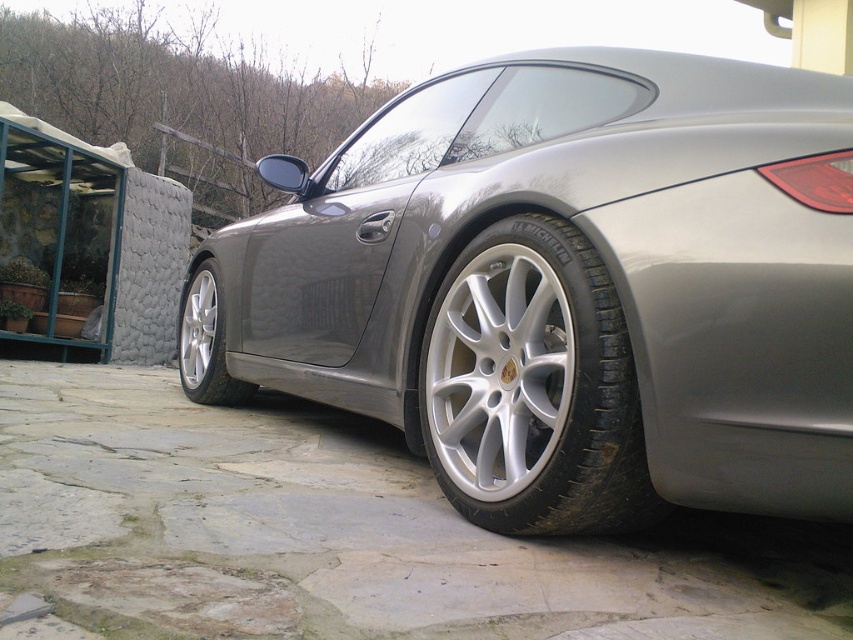
You are standing in front of a silver Porsche parked on a stone surface. You notice a silver metallic tire at lower center. Can you determine its exact position using coordinates?

The silver metallic tire at lower center is located at coordinates point (532, 387).

You are standing 5 feet away from the silver metallic tire at lower center. Can you reach it without moving your feet?

The silver metallic tire at lower center is 3.74 feet away from the viewer. Since you are standing 5 feet away, it is farther than your reach. You cannot reach it without moving your feet.